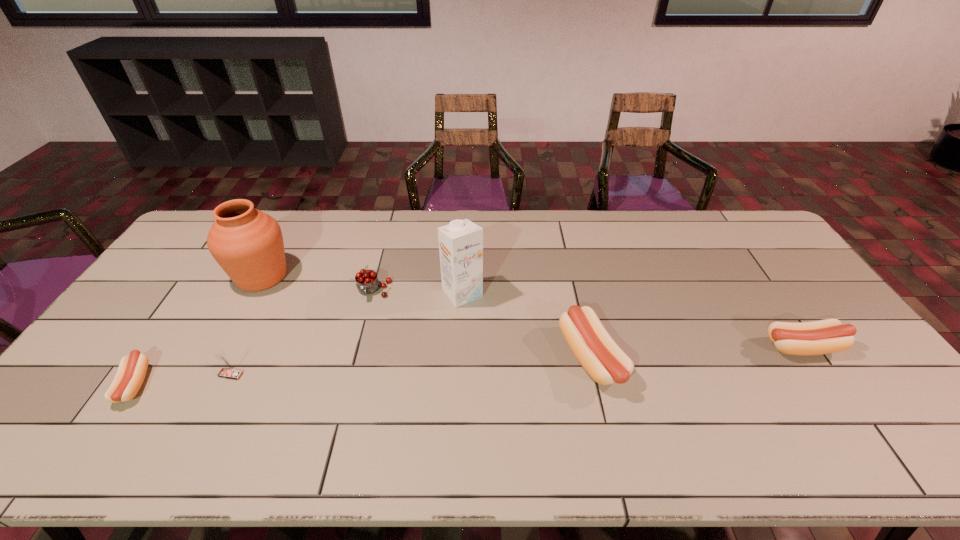
Find the location of a particular element. This screenshot has width=960, height=540. free space located 0.340m on the right of the second sausage from right to left is located at coordinates (749, 359).

This screenshot has width=960, height=540. I want to click on vacant space positioned 0.110m on the back of the second shortest object, so click(x=774, y=305).

This screenshot has height=540, width=960. What are the coordinates of `free region located 0.260m on the handle side of the cherry` in the screenshot? It's located at (352, 374).

Where is `vacant space located 0.320m on the front of the urn`? vacant space located 0.320m on the front of the urn is located at coordinates (201, 388).

Image resolution: width=960 pixels, height=540 pixels. I want to click on free spot located 0.260m on the front of the carton, so click(x=459, y=381).

Find the location of `vacant region located 0.370m on the back of the matchbox`. vacant region located 0.370m on the back of the matchbox is located at coordinates (281, 274).

This screenshot has width=960, height=540. Find the location of `object at the left edge`. object at the left edge is located at coordinates (132, 369).

At what (x,y) coordinates should I click in order to perform the action: click on object at the right edge. Please return your answer as a coordinate pair (x, y). This screenshot has height=540, width=960. Looking at the image, I should click on (826, 336).

Locate an element on the screen. This screenshot has width=960, height=540. object at the near left corner is located at coordinates (132, 369).

Identify the location of blank space at the far edge. This screenshot has width=960, height=540. (341, 244).